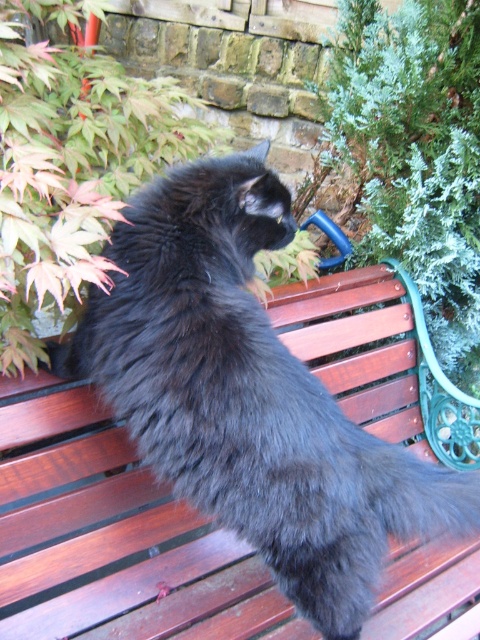
Question: Can you confirm if green leafy plant at upper left is smaller than black fluffy tail at center?

Choices:
 (A) yes
 (B) no

Answer: (B)

Question: Based on their relative distances, which object is farther from the black fluffy tail at center?

Choices:
 (A) black fluffy cat at center
 (B) green leafy plant at upper left

Answer: (B)

Question: Does green leafy plant at upper left have a smaller size compared to black fluffy tail at center?

Choices:
 (A) yes
 (B) no

Answer: (B)

Question: Among these points, which one is farthest from the camera?

Choices:
 (A) (432, 532)
 (B) (216, 518)
 (C) (20, 224)

Answer: (A)

Question: Does black fluffy cat at center have a smaller size compared to green leafy plant at upper left?

Choices:
 (A) no
 (B) yes

Answer: (B)

Question: Which object appears farthest from the camera in this image?

Choices:
 (A) black fluffy cat at center
 (B) green leafy plant at upper left
 (C) black fluffy tail at center

Answer: (C)